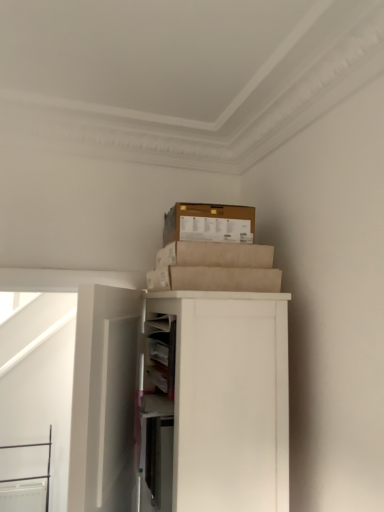
Question: Is brown cardboard box at upper center smaller than white matte door at left?

Choices:
 (A) yes
 (B) no

Answer: (A)

Question: Does brown cardboard box at upper center come in front of white matte door at left?

Choices:
 (A) no
 (B) yes

Answer: (A)

Question: From a real-world perspective, is brown cardboard box at upper center positioned under white matte door at left based on gravity?

Choices:
 (A) yes
 (B) no

Answer: (B)

Question: Is white matte door at left at the back of brown cardboard box at upper center?

Choices:
 (A) no
 (B) yes

Answer: (A)

Question: Is brown cardboard box at upper center at the left side of white matte door at left?

Choices:
 (A) no
 (B) yes

Answer: (A)

Question: Is brown cardboard box at upper center facing towards white matte door at left?

Choices:
 (A) yes
 (B) no

Answer: (B)

Question: From the image's perspective, is brown cardboard box at upper center below white matte cabinet at upper right?

Choices:
 (A) no
 (B) yes

Answer: (A)

Question: Is brown cardboard box at upper center oriented away from white matte cabinet at upper right?

Choices:
 (A) no
 (B) yes

Answer: (A)

Question: Considering the relative sizes of brown cardboard box at upper center and white matte cabinet at upper right in the image provided, is brown cardboard box at upper center taller than white matte cabinet at upper right?

Choices:
 (A) yes
 (B) no

Answer: (B)

Question: Is brown cardboard box at upper center positioned beyond the bounds of white matte cabinet at upper right?

Choices:
 (A) no
 (B) yes

Answer: (B)

Question: Is brown cardboard box at upper center positioned far away from white matte cabinet at upper right?

Choices:
 (A) no
 (B) yes

Answer: (A)

Question: Considering the relative sizes of brown cardboard box at upper center and white matte cabinet at upper right in the image provided, is brown cardboard box at upper center shorter than white matte cabinet at upper right?

Choices:
 (A) yes
 (B) no

Answer: (A)

Question: From the image's perspective, is white matte cabinet at upper right over white matte door at left?

Choices:
 (A) no
 (B) yes

Answer: (B)